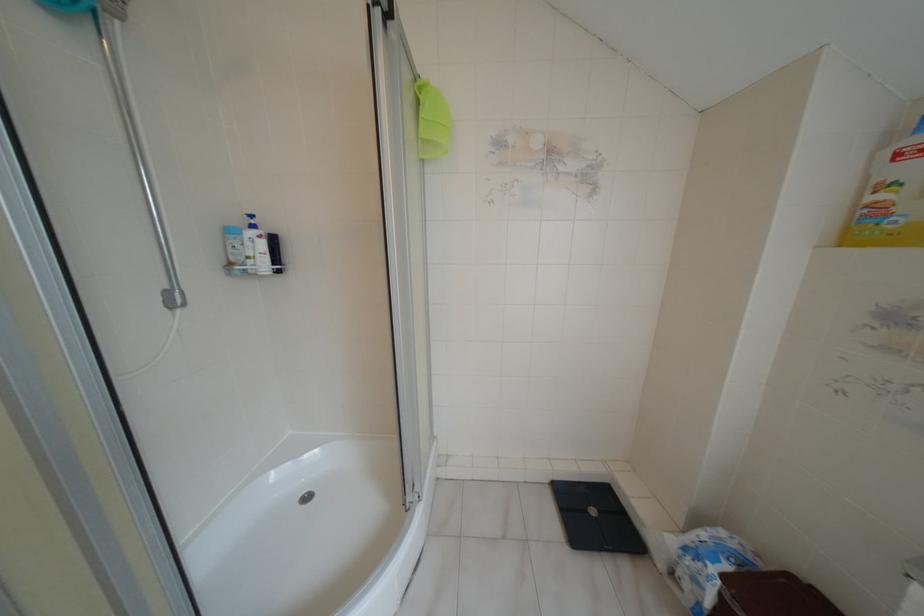
The image size is (924, 616). Find the location of `yellow cleaning bottle`. yellow cleaning bottle is located at coordinates (891, 198).